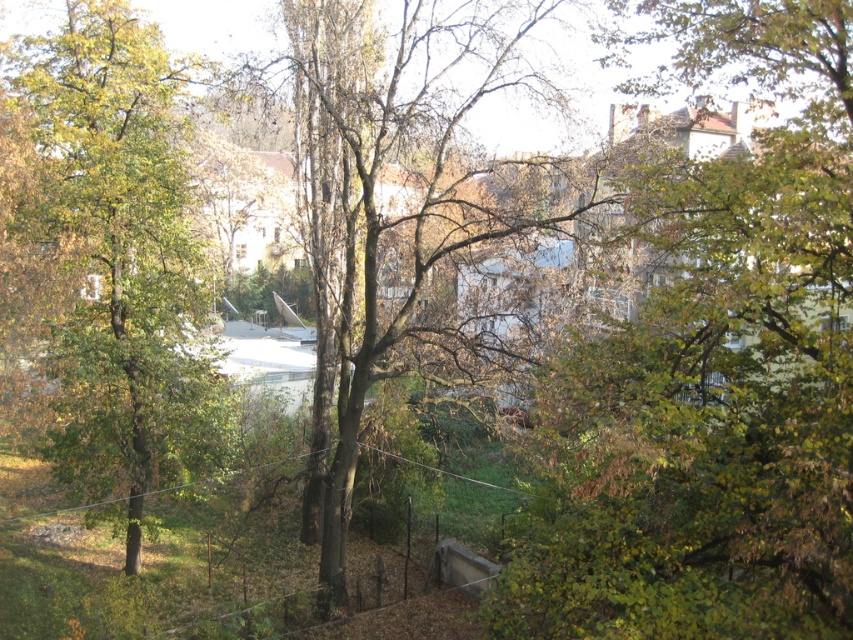
Can you confirm if green leafy tree at upper right is smaller than green matte tree at center?

Yes.

Does green leafy tree at upper right have a greater width compared to green matte tree at center?

Incorrect, green leafy tree at upper right's width does not surpass green matte tree at center's.

Which is in front, point (706, 220) or point (91, 236)?

Positioned in front is point (706, 220).

What are the coordinates of `green leafy tree at upper right` in the screenshot? It's located at tap(715, 376).